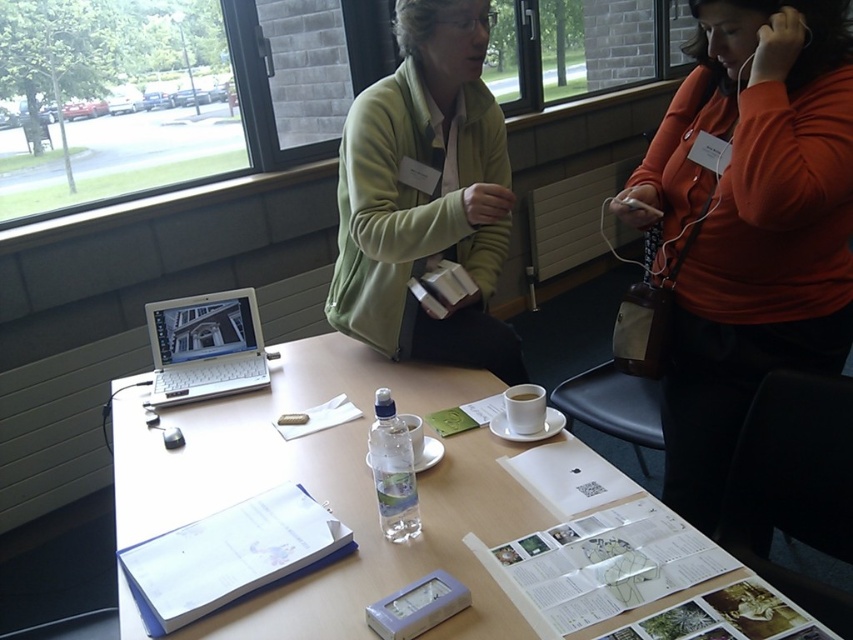
Question: Does orange matte sweater at upper right have a greater width compared to white plastic laptop at center?

Choices:
 (A) yes
 (B) no

Answer: (A)

Question: Considering the relative positions of white paper at center and green fleece jacket at upper center in the image provided, where is white paper at center located with respect to green fleece jacket at upper center?

Choices:
 (A) right
 (B) left

Answer: (B)

Question: Which of the following is the farthest from the observer?

Choices:
 (A) orange matte sweater at upper right
 (B) clear plastic bottle at center
 (C) white ceramic cup at center

Answer: (C)

Question: Based on their relative distances, which object is nearer to the clear plastic bottle at center?

Choices:
 (A) white paper at center
 (B) green fleece jacket at upper center
 (C) white ceramic cup at center
 (D) orange matte sweater at upper right

Answer: (A)

Question: Which of the following is the closest to the observer?

Choices:
 (A) orange matte sweater at upper right
 (B) white paper at center

Answer: (B)

Question: Considering the relative positions of white plastic laptop at center and white ceramic cup at center in the image provided, where is white plastic laptop at center located with respect to white ceramic cup at center?

Choices:
 (A) left
 (B) right

Answer: (A)